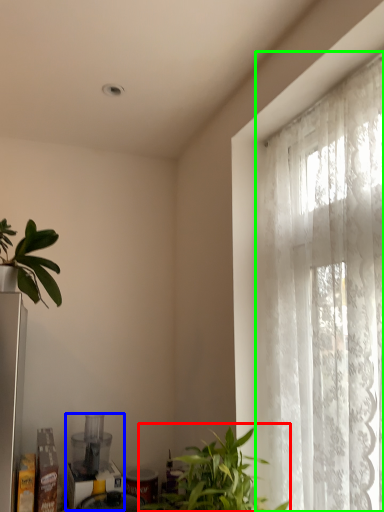
Question: Which object is positioned closest to houseplant (highlighted by a red box)? Select from appliance (highlighted by a blue box) and window (highlighted by a green box).

Choices:
 (A) appliance
 (B) window

Answer: (B)